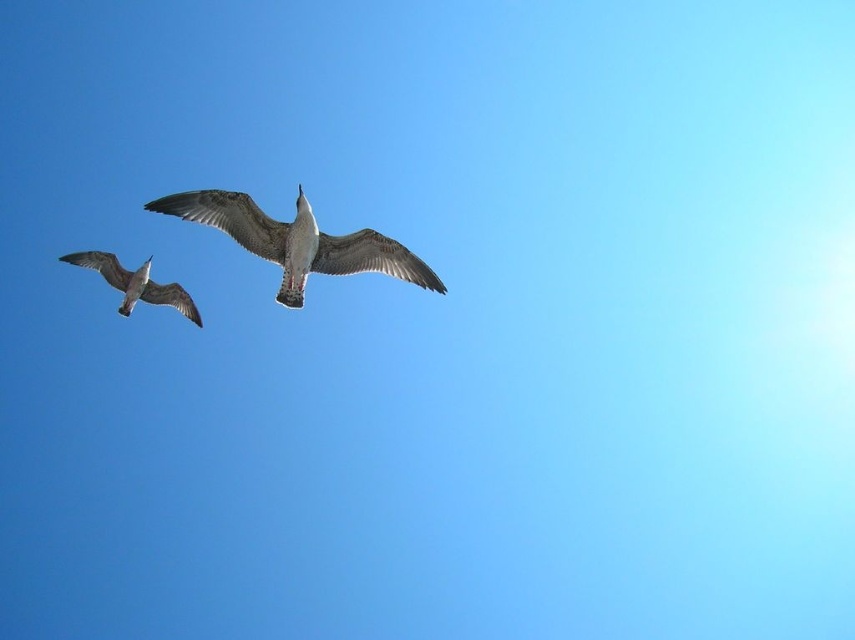
You are a drone operator trying to capture a photo of two seagulls. The first seagull is at point (228, 234) and the second is at point (131, 291). According to the scene description, which seagull is closer to the camera?

Point (228, 234) is in front of point (131, 291), so the first seagull at point (228, 234) is closer to the camera.